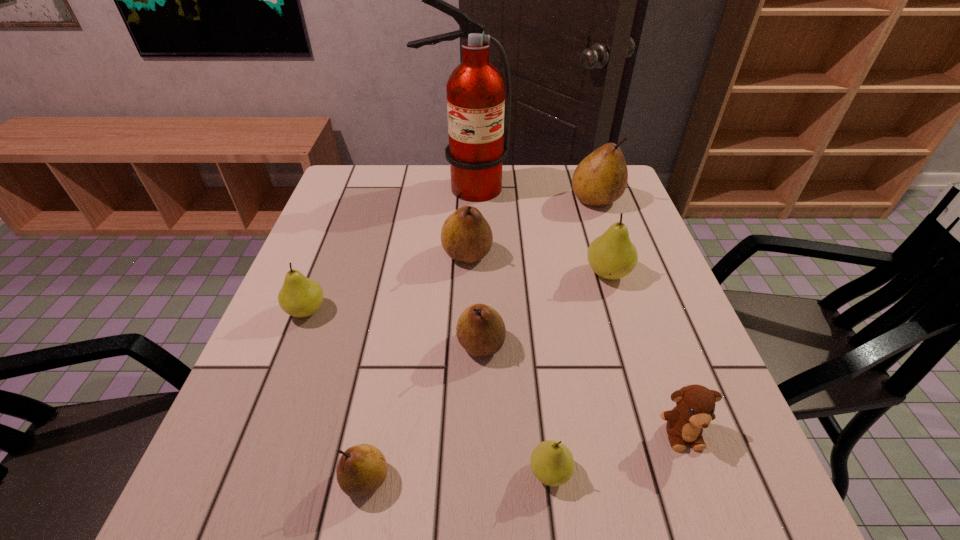
Locate an element on the screen. The image size is (960, 540). vacant space that's between the second farthest brown pear and the leftmost brown pear is located at coordinates (417, 367).

Image resolution: width=960 pixels, height=540 pixels. Find the location of `unoccupied area between the teddy bear and the second nearest green pear`. unoccupied area between the teddy bear and the second nearest green pear is located at coordinates (494, 372).

Image resolution: width=960 pixels, height=540 pixels. Find the location of `vacant space in between the tallest object and the third biggest brown pear`. vacant space in between the tallest object and the third biggest brown pear is located at coordinates (473, 266).

Locate an element on the screen. object that ranks as the fourth closest to the second green pear from left to right is located at coordinates [x=612, y=256].

Identify which object is the second closest to the biggest brown pear. Please provide its 2D coordinates. Your answer should be formatted as a tuple, i.e. [(x, y)], where the tuple contains the x and y coordinates of a point satisfying the conditions above.

[(612, 256)]

Select which pear appears as the fifth closest to the fire extinguisher. Please provide its 2D coordinates. Your answer should be formatted as a tuple, i.e. [(x, y)], where the tuple contains the x and y coordinates of a point satisfying the conditions above.

[(480, 330)]

Point out which pear is positioned as the fourth nearest to the second biggest brown pear. Please provide its 2D coordinates. Your answer should be formatted as a tuple, i.e. [(x, y)], where the tuple contains the x and y coordinates of a point satisfying the conditions above.

[(601, 178)]

Locate an element on the screen. This screenshot has height=540, width=960. brown pear object that ranks as the third closest to the third biggest brown pear is located at coordinates click(x=601, y=178).

Select which brown pear appears as the closest to the leftmost brown pear. Please provide its 2D coordinates. Your answer should be formatted as a tuple, i.e. [(x, y)], where the tuple contains the x and y coordinates of a point satisfying the conditions above.

[(480, 330)]

Identify which green pear is located as the nearest to the teddy bear. Please provide its 2D coordinates. Your answer should be formatted as a tuple, i.e. [(x, y)], where the tuple contains the x and y coordinates of a point satisfying the conditions above.

[(552, 463)]